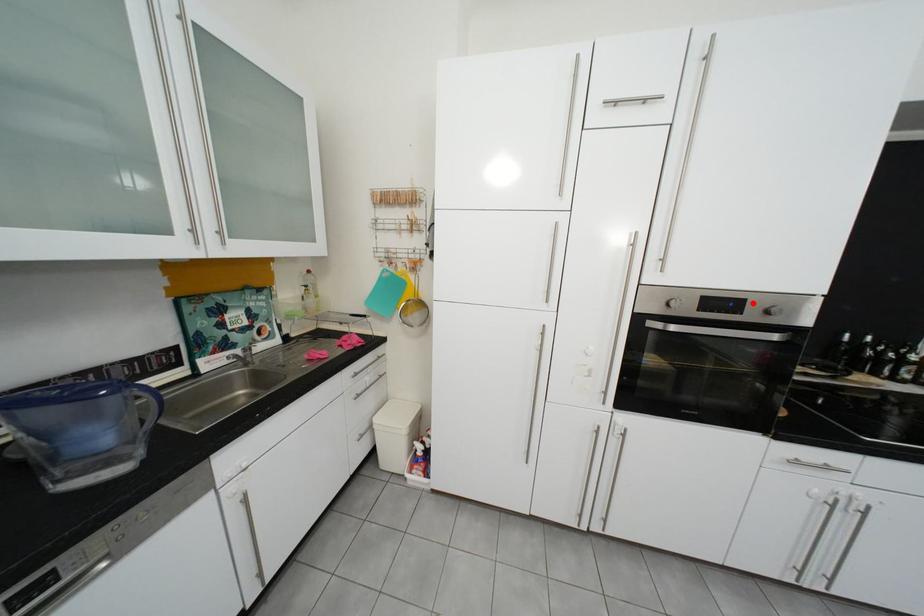
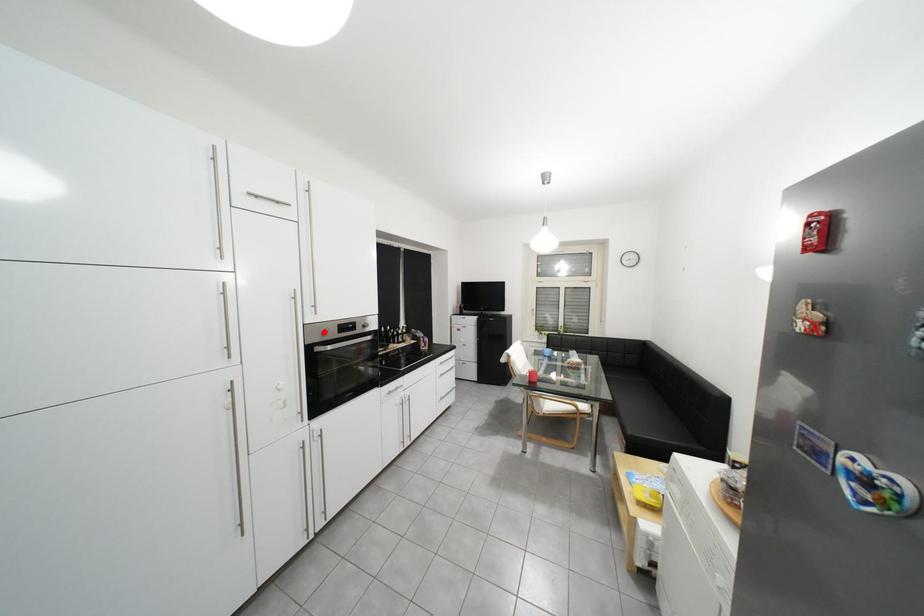
I am providing you with two images of the same scene from different viewpoints. A red point is marked on the first image and another point is marked on the second image. Is the marked point in image1 the same physical position as the marked point in image2?

No